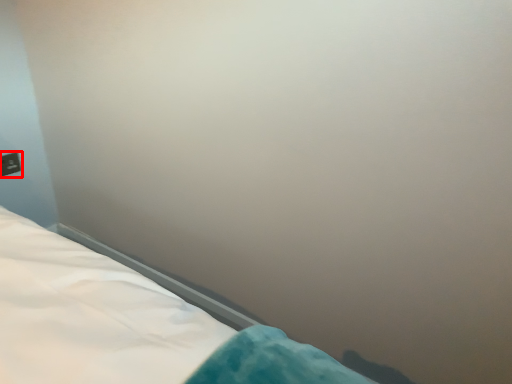
Question: From the image, what is the correct spatial relationship of electric outlet (annotated by the red box) in relation to bed?

Choices:
 (A) right
 (B) left

Answer: (B)